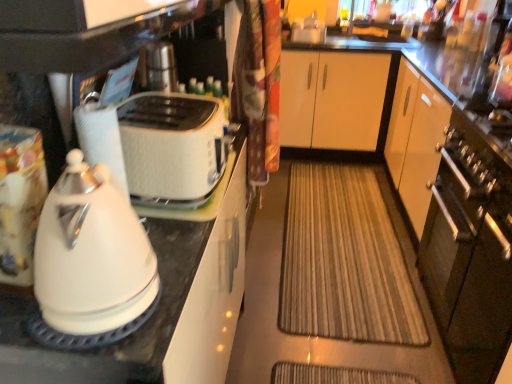
I want to click on white textured toaster at center, so click(172, 147).

Measure the distance between point (366, 216) and camera.

Point (366, 216) is 8.93 feet from camera.

Image resolution: width=512 pixels, height=384 pixels. What do you see at coordinates (156, 309) in the screenshot?
I see `white glossy toaster at left` at bounding box center [156, 309].

The width and height of the screenshot is (512, 384). What are the coordinates of `white glossy paper towel at left` in the screenshot? It's located at (101, 138).

Where is `white glossy kettle at left`? This screenshot has height=384, width=512. white glossy kettle at left is located at coordinates (91, 255).

What are the coordinates of `white textured toaster at center` in the screenshot? It's located at (172, 147).

I want to click on kitchen appliance positioned vertically above the white glossy toaster at left (from a real-world perspective), so click(x=91, y=255).

Is white glossy toaster at left surrounded by white glossy kettle at left?

No, white glossy toaster at left is not inside white glossy kettle at left.

Measure the distance from white glossy kettle at left to white glossy toaster at left.

The distance of white glossy kettle at left from white glossy toaster at left is 10.00 inches.

Considering the sizes of objects white glossy kettle at left and white glossy toaster at left in the image provided, who is bigger, white glossy kettle at left or white glossy toaster at left?

white glossy toaster at left is bigger.

Is brown textured mat at center at the back of white glossy paper towel at left?

Result: No.

In the scene shown: Considering the positions of objects white glossy paper towel at left and brown textured mat at center in the image provided, who is more to the left, white glossy paper towel at left or brown textured mat at center?

From the viewer's perspective, white glossy paper towel at left appears more on the left side.

Does white glossy paper towel at left have a greater height compared to brown textured mat at center?

Indeed, white glossy paper towel at left has a greater height compared to brown textured mat at center.

Can you tell me how much white glossy paper towel at left and brown textured mat at center differ in facing direction?

They differ by 90.4 degrees in their facing directions.

From a real-world perspective, is satin silver oven at right physically located above or below brown textured mat at center?

satin silver oven at right is above brown textured mat at center.

Between point (429, 266) and point (374, 244), which one is positioned in front?

Point (429, 266)

How distant is satin silver oven at right from brown textured mat at center?

22.02 inches.

Based on the photo, can you tell me how much satin silver oven at right and brown textured mat at center differ in facing direction?

There is a 89.2-degree angle between the facing directions of satin silver oven at right and brown textured mat at center.

Is satin silver oven at right inside white glossy toaster at left?

Definitely not — satin silver oven at right is not inside white glossy toaster at left.

From a real-world perspective, who is located lower, white glossy toaster at left or satin silver oven at right?

satin silver oven at right is physically lower.

Considering the sizes of white glossy toaster at left and satin silver oven at right in the image, is white glossy toaster at left wider or thinner than satin silver oven at right?

In the image, white glossy toaster at left appears to be more narrow than satin silver oven at right.

Does white glossy toaster at left lie behind satin silver oven at right?

No, it is in front of satin silver oven at right.

Which object is thinner, white glossy paper towel at left or white glossy toaster at left?

With smaller width is white glossy paper towel at left.

Which object is more forward, white glossy paper towel at left or white glossy toaster at left?

white glossy toaster at left is closer to the camera.

Considering the sizes of objects white glossy paper towel at left and white glossy toaster at left in the image provided, who is taller, white glossy paper towel at left or white glossy toaster at left?

white glossy toaster at left is taller.

Is white glossy paper towel at left facing towards white glossy toaster at left?

No, white glossy paper towel at left is not oriented towards white glossy toaster at left.

Would you say white glossy kettle at left is outside satin silver oven at right?

Yes.

Locate an element on the screen. Image resolution: width=512 pixels, height=384 pixels. oven behind the white glossy kettle at left is located at coordinates (470, 253).

Between white glossy kettle at left and satin silver oven at right, which one is positioned in front?

white glossy kettle at left.

Considering the positions of objects satin silver oven at right and white glossy toaster at left in the image provided, who is behind, satin silver oven at right or white glossy toaster at left?

satin silver oven at right is more distant.

Does satin silver oven at right appear on the left side of white glossy toaster at left?

No.

Can we say satin silver oven at right lies outside white glossy toaster at left?

Yes.

Does satin silver oven at right turn towards white glossy toaster at left?

Yes, satin silver oven at right is aimed at white glossy toaster at left.

This screenshot has height=384, width=512. Find the location of `kitchen appliance on the right of white glossy toaster at left`. kitchen appliance on the right of white glossy toaster at left is located at coordinates (91, 255).

The image size is (512, 384). In order to click on paper towel positioned vertically above the brown textured mat at center (from a real-world perspective) in this screenshot , I will do click(x=101, y=138).

Based on their spatial positions, is white glossy toaster at left or white glossy kettle at left further from brown textured mat at center?

white glossy kettle at left is further to brown textured mat at center.

Considering their positions, is white glossy paper towel at left positioned closer to white glossy kettle at left than brown textured mat at center?

Among the two, white glossy paper towel at left is located nearer to white glossy kettle at left.

When comparing their distances from brown textured mat at center, does white glossy paper towel at left or white glossy kettle at left seem further?

Based on the image, white glossy paper towel at left appears to be further to brown textured mat at center.

Based on their spatial positions, is white glossy toaster at left or white textured toaster at center further from white glossy kettle at left?

white textured toaster at center is further to white glossy kettle at left.

From the image, which object appears to be farther from satin silver oven at right, white glossy toaster at left or brown textured mat at center?

white glossy toaster at left is positioned further to the anchor satin silver oven at right.

Estimate the real-world distances between objects in this image. Which object is closer to white textured toaster at center, white glossy paper towel at left or white glossy toaster at left?

white glossy paper towel at left.

Looking at the image, which one is located closer to brown textured mat at center, white glossy toaster at left or satin silver oven at right?

satin silver oven at right.

When comparing their distances from brown textured mat at center, does satin silver oven at right or white textured toaster at center seem further?

The object further to brown textured mat at center is white textured toaster at center.

Find the location of a particular element. Image resolution: width=512 pixels, height=384 pixels. kitchen appliance between white textured toaster at center and white glossy toaster at left in the up-down direction is located at coordinates (91, 255).

Locate an element on the screen. This screenshot has width=512, height=384. kitchen appliance between white glossy toaster at left and satin silver oven at right in the horizontal direction is located at coordinates (91, 255).

Find the location of a particular element. The width and height of the screenshot is (512, 384). wide situated between white textured toaster at center and satin silver oven at right from left to right is located at coordinates click(344, 261).

Where is `toaster between white glossy toaster at left and satin silver oven at right in the horizontal direction`? toaster between white glossy toaster at left and satin silver oven at right in the horizontal direction is located at coordinates (172, 147).